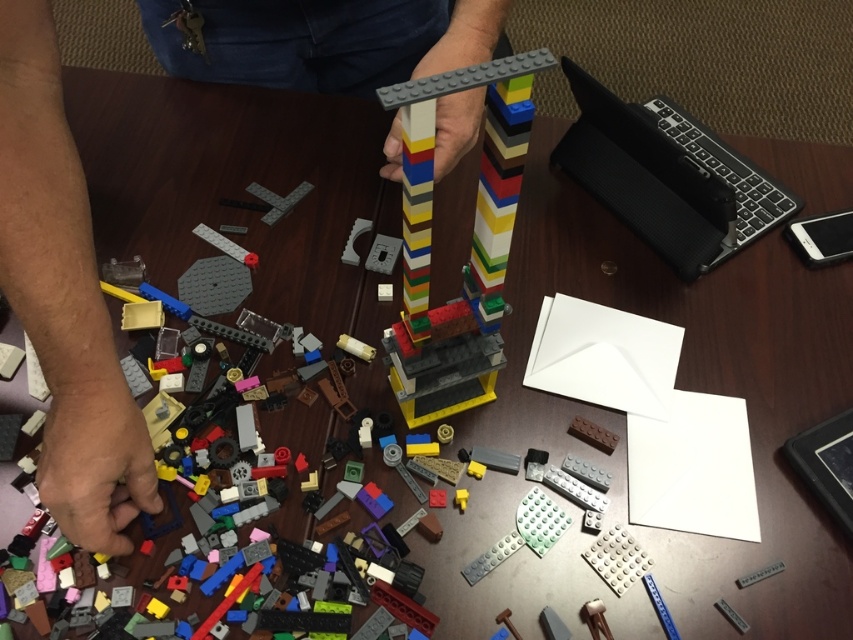
Question: From the image, what is the correct spatial relationship of smooth plastic hands at center in relation to black textured laptop at upper right?

Choices:
 (A) below
 (B) above

Answer: (A)

Question: Can you confirm if smooth plastic hands at center is thinner than black textured laptop at upper right?

Choices:
 (A) yes
 (B) no

Answer: (A)

Question: Which point is farther from the camera taking this photo?

Choices:
 (A) (48, 484)
 (B) (457, 131)

Answer: (B)

Question: Observing the image, what is the correct spatial positioning of smooth plastic hands at center in reference to smooth skin hand at lower left?

Choices:
 (A) below
 (B) above

Answer: (A)

Question: Estimate the real-world distances between objects in this image. Which object is farther from the smooth skin hand at lower left?

Choices:
 (A) multicolored plastic tower at center
 (B) black textured laptop at upper right

Answer: (B)

Question: Which point is closer to the camera?

Choices:
 (A) 610,156
 (B) 496,74

Answer: (B)